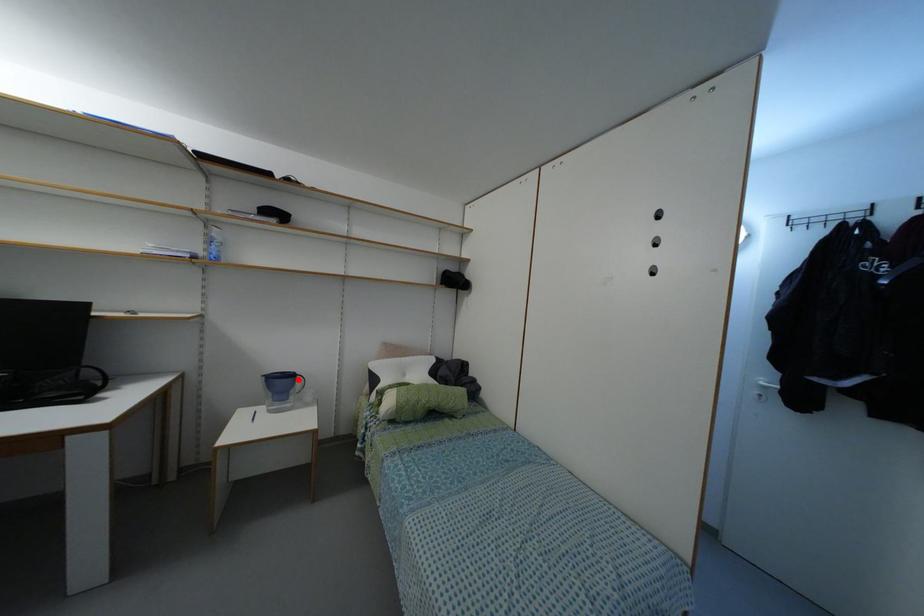
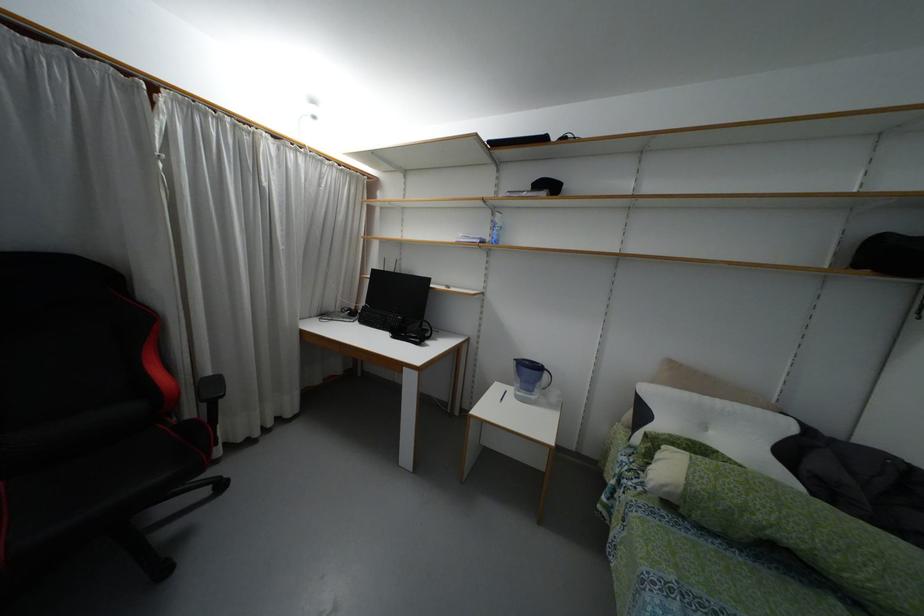
Question: I am providing you with two images of the same scene from different viewpoints. A red point is shown in image1. For the corresponding object point in image2, is it positioned nearer or farther from the camera?

Choices:
 (A) Nearer
 (B) Farther

Answer: (B)